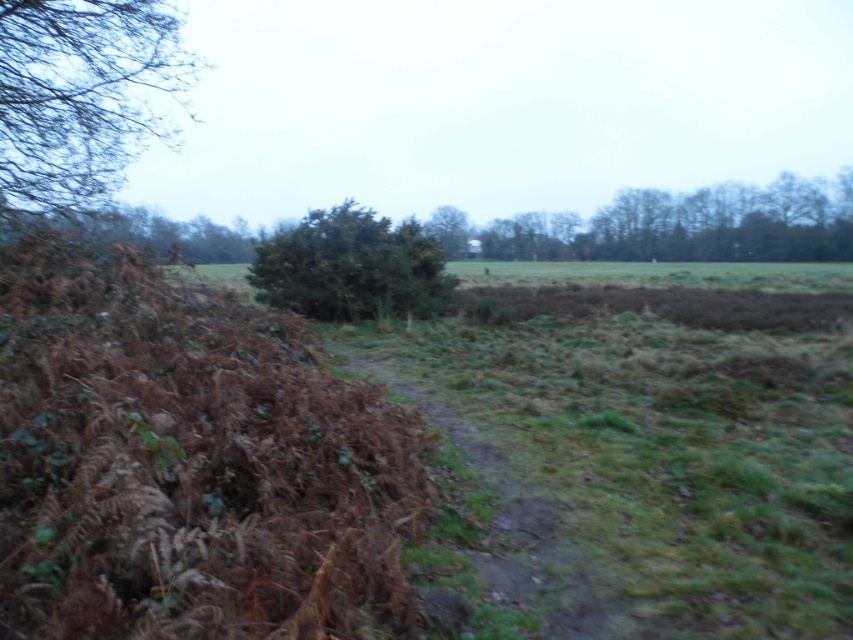
Question: From the image, what is the correct spatial relationship of brown textured bush at upper left in relation to green leafy tree at upper center?

Choices:
 (A) right
 (B) left

Answer: (B)

Question: Based on their relative distances, which object is farther from the green grassy trail at center?

Choices:
 (A) green leafy tree at center
 (B) green leafy tree at upper center
 (C) brown textured bush at upper left

Answer: (B)

Question: Does green leafy tree at upper center appear on the right side of green grassy trail at center?

Choices:
 (A) yes
 (B) no

Answer: (A)

Question: Which point is farther to the camera?

Choices:
 (A) green leafy tree at upper center
 (B) brown textured bush at upper left

Answer: (A)

Question: Is brown textured bush at upper left below green leafy tree at upper center?

Choices:
 (A) no
 (B) yes

Answer: (B)

Question: Which point is closer to the camera?

Choices:
 (A) brown textured bush at upper left
 (B) green leafy tree at center
 (C) green leafy tree at upper center

Answer: (A)